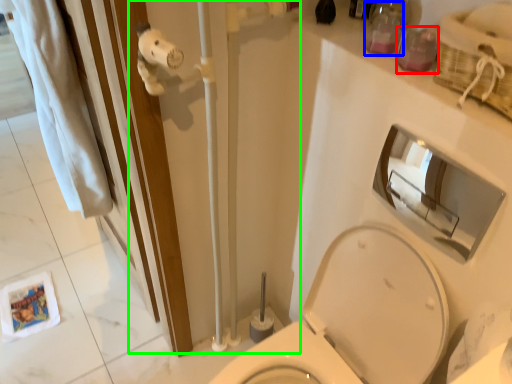
Question: Which object is positioned closest to toiletry (highlighted by a red box)? Select from toiletry (highlighted by a blue box) and shower door (highlighted by a green box).

Choices:
 (A) toiletry
 (B) shower door

Answer: (A)